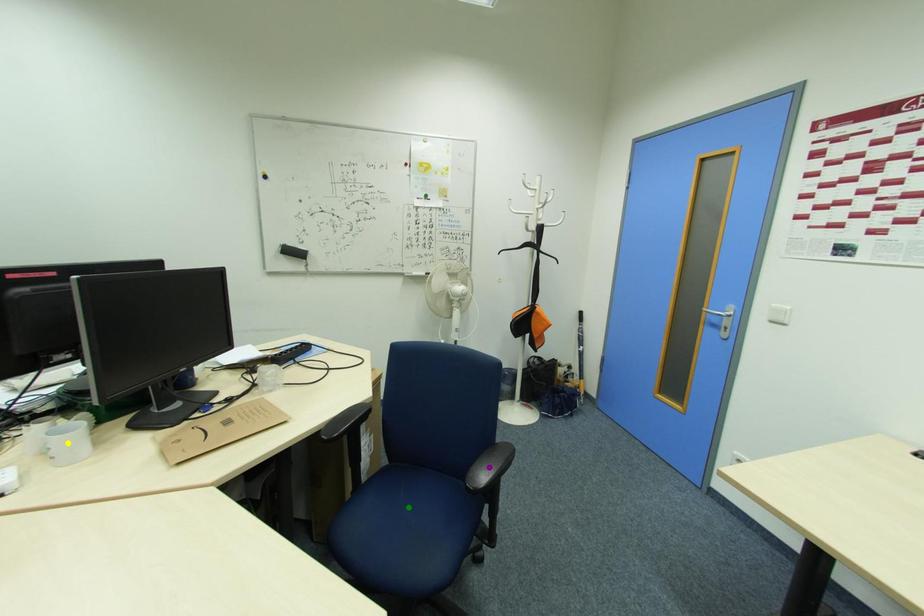
Order these from nearest to farthest:
- purple point
- yellow point
- green point

yellow point < green point < purple point